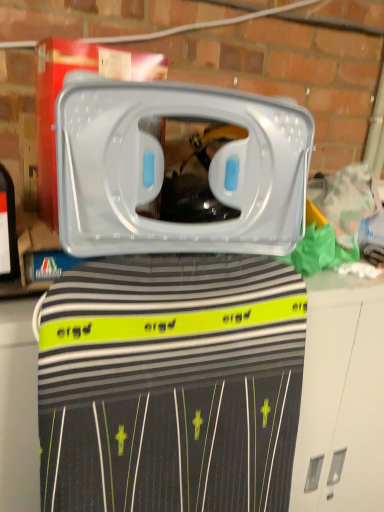
Question: Would you say transparent plastic container at center contains black striped fabric at center?

Choices:
 (A) no
 (B) yes

Answer: (A)

Question: Is transparent plastic container at center taller than black striped fabric at center?

Choices:
 (A) no
 (B) yes

Answer: (A)

Question: Is transparent plastic container at center looking in the opposite direction of black striped fabric at center?

Choices:
 (A) no
 (B) yes

Answer: (A)

Question: Considering the relative sizes of transparent plastic container at center and black striped fabric at center in the image provided, is transparent plastic container at center wider than black striped fabric at center?

Choices:
 (A) no
 (B) yes

Answer: (A)

Question: Is the position of transparent plastic container at center less distant than that of black striped fabric at center?

Choices:
 (A) yes
 (B) no

Answer: (A)

Question: Considering the relative positions of transparent plastic container at center and black striped fabric at center in the image provided, is transparent plastic container at center to the right of black striped fabric at center from the viewer's perspective?

Choices:
 (A) yes
 (B) no

Answer: (B)

Question: Does black striped fabric at center lie in front of transparent plastic container at center?

Choices:
 (A) no
 (B) yes

Answer: (A)

Question: Are black striped fabric at center and transparent plastic container at center located far from each other?

Choices:
 (A) yes
 (B) no

Answer: (B)

Question: Does black striped fabric at center have a greater height compared to transparent plastic container at center?

Choices:
 (A) no
 (B) yes

Answer: (B)

Question: Considering the relative positions of black striped fabric at center and transparent plastic container at center in the image provided, is black striped fabric at center to the right of transparent plastic container at center from the viewer's perspective?

Choices:
 (A) yes
 (B) no

Answer: (A)

Question: Is black striped fabric at center positioned behind transparent plastic container at center?

Choices:
 (A) yes
 (B) no

Answer: (A)

Question: Is black striped fabric at center located outside transparent plastic container at center?

Choices:
 (A) no
 (B) yes

Answer: (B)

Question: Is transparent plastic container at center bigger or smaller than black striped fabric at center?

Choices:
 (A) small
 (B) big

Answer: (A)